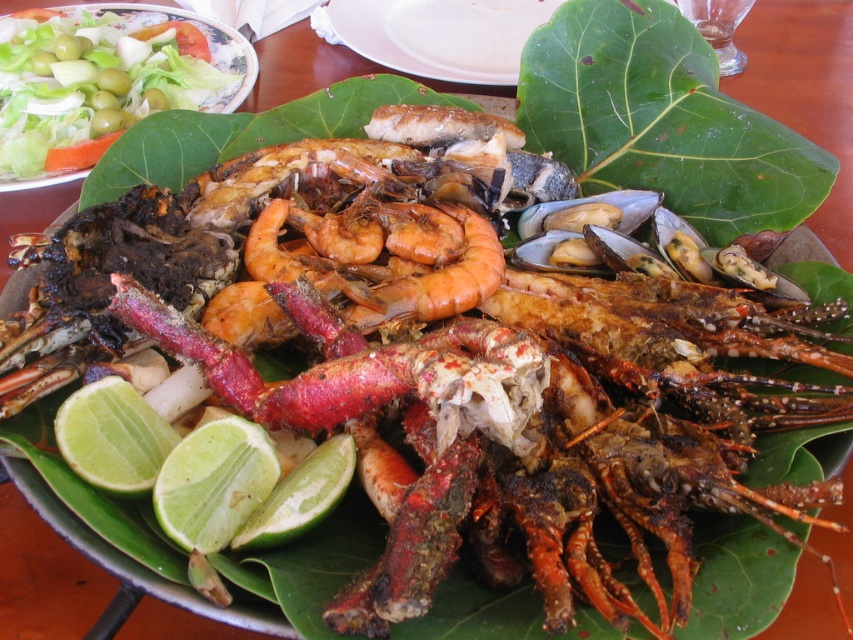
Can you confirm if green leafy platter at center is wider than green matte lemon at lower center?

Yes, green leafy platter at center is wider than green matte lemon at lower center.

From the picture: Is green leafy platter at center shorter than green matte lemon at lower center?

No, green leafy platter at center is not shorter than green matte lemon at lower center.

Is point (328, 20) positioned before point (253, 480)?

No, (328, 20) is further to viewer.

The height and width of the screenshot is (640, 853). In order to click on green leafy platter at center in this screenshot , I will do `click(437, 35)`.

Does green matte lemon at lower center have a lesser width compared to green matte lemon at lower left?

Indeed, green matte lemon at lower center has a lesser width compared to green matte lemon at lower left.

Does green matte lemon at lower center have a lesser height compared to green matte lemon at lower left?

No, green matte lemon at lower center is not shorter than green matte lemon at lower left.

In order to click on green matte lemon at lower center in this screenshot , I will do `click(213, 483)`.

Is green leafy at center bigger than green matte lemon at lower center?

Yes, green leafy at center is bigger than green matte lemon at lower center.

Is green leafy at center to the left of green matte lemon at lower center from the viewer's perspective?

No, green leafy at center is not to the left of green matte lemon at lower center.

Where is `green leafy at center`? green leafy at center is located at coordinates (662, 120).